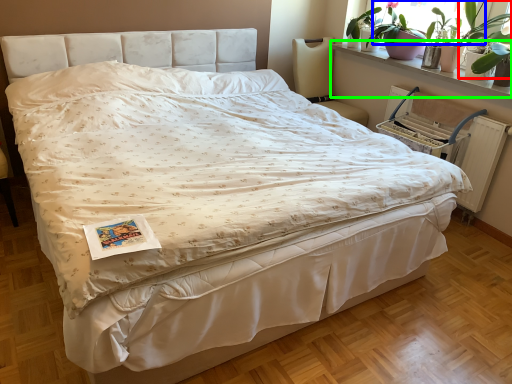
Question: Estimate the real-world distances between objects in this image. Which object is closer to plant (highlighted by a red box), window screen (highlighted by a blue box) or window sill (highlighted by a green box)?

Choices:
 (A) window screen
 (B) window sill

Answer: (A)